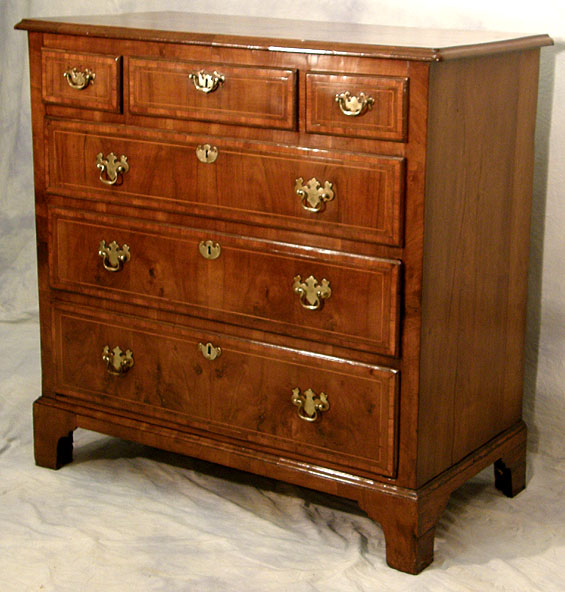
Find the location of `top drawer`. top drawer is located at coordinates (224, 88).